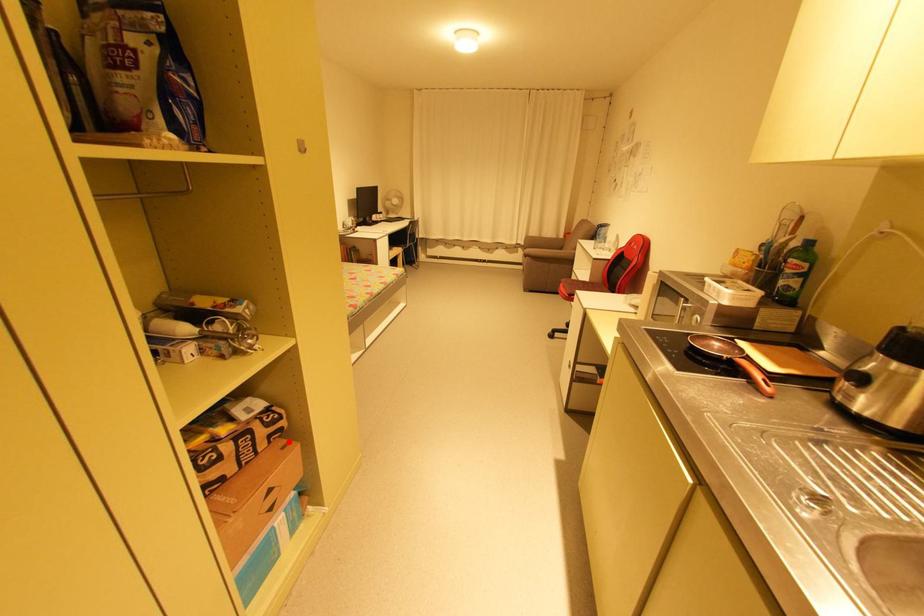
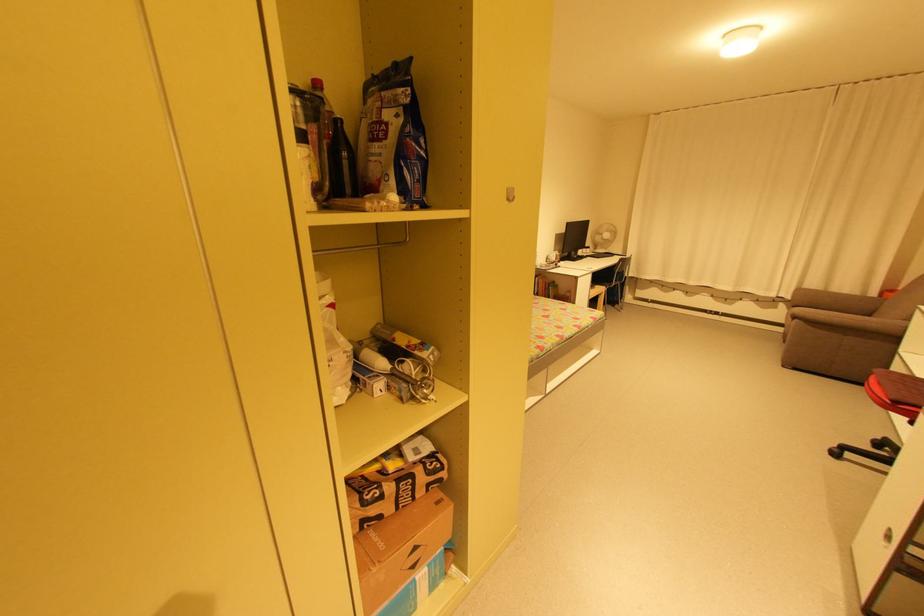
Question: I am providing you with two images of the same scene from different viewpoints. A red point is shown in image1. For the corresponding object point in image2, is it positioned nearer or farther from the camera?

Choices:
 (A) Nearer
 (B) Farther

Answer: (B)